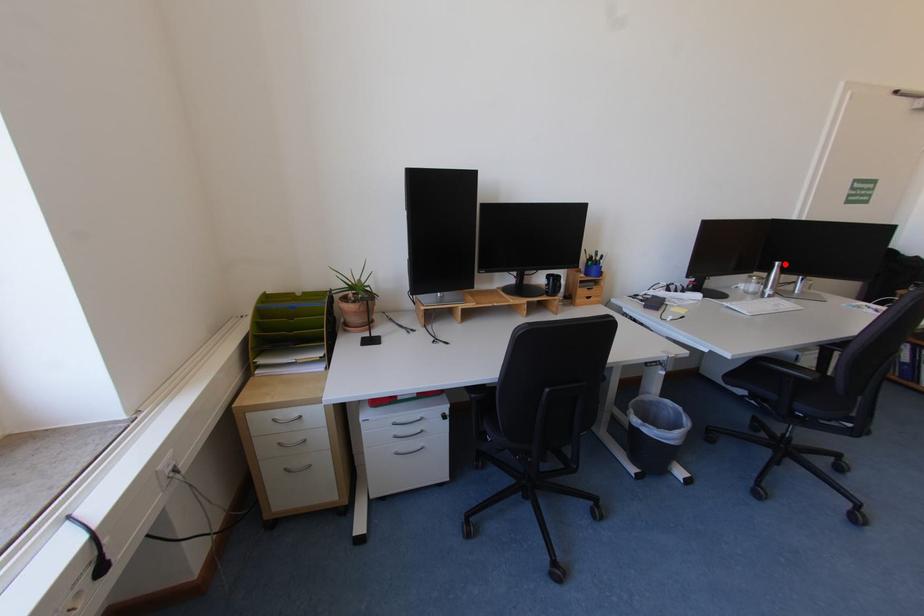
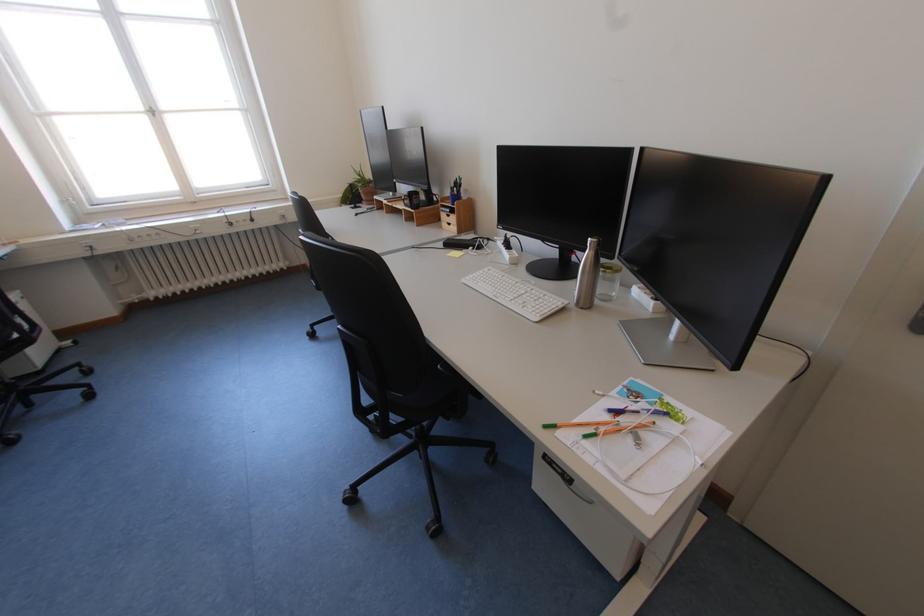
Question: I am providing you with two images of the same scene from different viewpoints. Given a red point in image1, look at the same physical point in image2. Is it:

Choices:
 (A) Closer to the viewpoint
 (B) Farther from the viewpoint

Answer: (A)